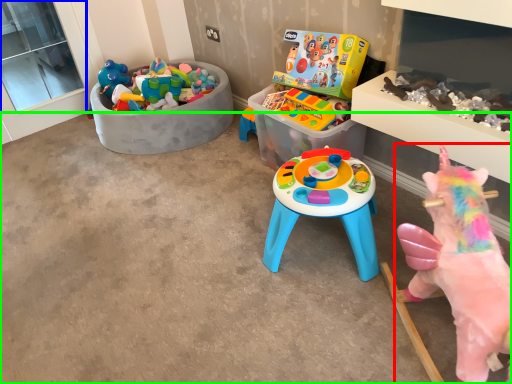
Question: Which object is positioned farthest from toy (highlighted by a red box)? Select from window screen (highlighted by a blue box) and concrete (highlighted by a green box).

Choices:
 (A) window screen
 (B) concrete

Answer: (A)